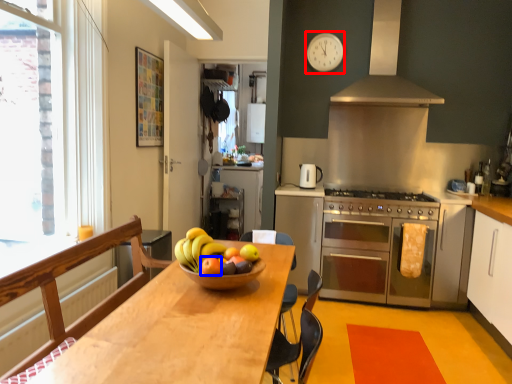
Question: Which object is closer to the camera taking this photo, clock (highlighted by a red box) or apple (highlighted by a blue box)?

Choices:
 (A) clock
 (B) apple

Answer: (B)